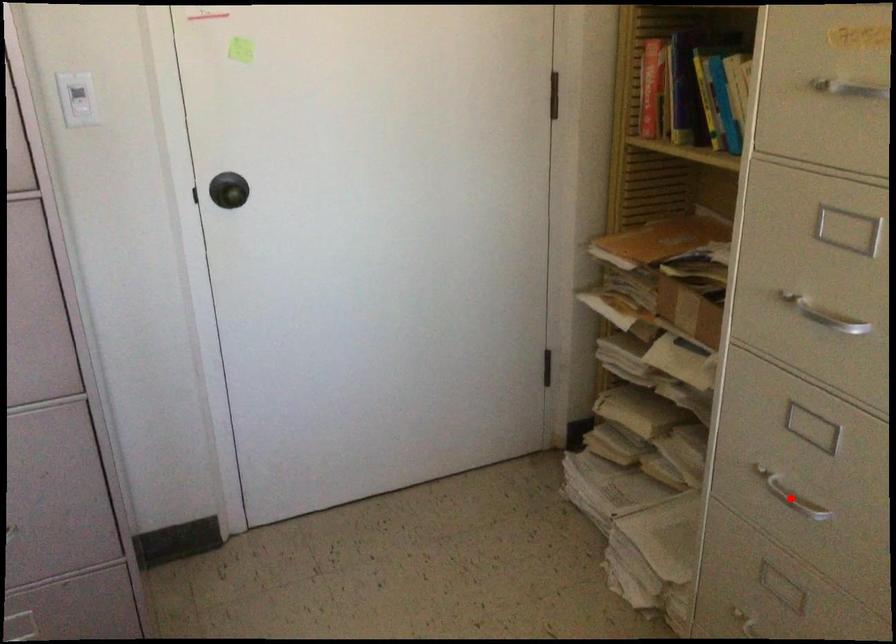
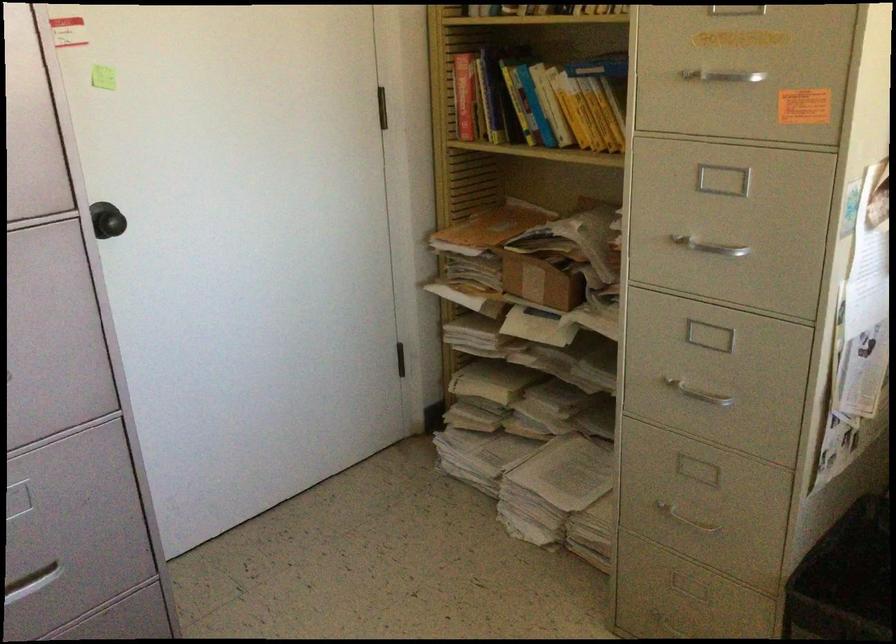
Question: A red point is marked in image1. In image2, is the corresponding 3D point closer to the camera or farther? Reply with the corresponding letter.

Choices:
 (A) The corresponding 3D point is closer.
 (B) The corresponding 3D point is farther.

Answer: (B)